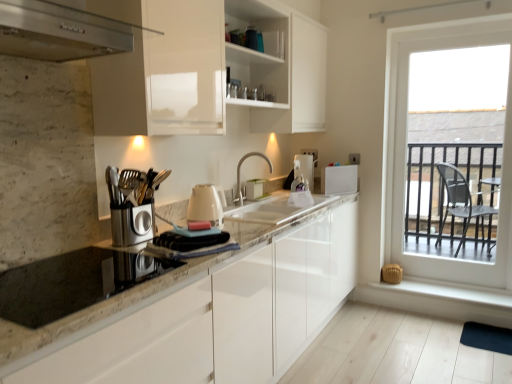
Question: From the image's perspective, is granite countertop at center positioned above or below white plastic toaster at upper right, placed as the 1th appliance when sorted from right to left?

Choices:
 (A) below
 (B) above

Answer: (A)

Question: From a real-world perspective, is granite countertop at center physically located above or below white plastic toaster at upper right, the 3th appliance viewed from the front?

Choices:
 (A) below
 (B) above

Answer: (A)

Question: Which of these objects is positioned farthest from the white glossy kettle at center, arranged as the 2th appliance when viewed from the front?

Choices:
 (A) clear glass window at right
 (B) satin nickel faucet at center
 (C) white marble sink at center
 (D) dark blue rubber mat at lower right
 (E) granite countertop at center

Answer: (D)

Question: Considering the real-world distances, which object is closest to the white marble sink at center?

Choices:
 (A) white smooth window sill at lower right
 (B) dark blue rubber mat at lower right
 (C) white glossy tissue box at center, which is the fourth appliance from front to back
 (D) black glass cooktop at lower left, placed as the 4th appliance when sorted from right to left
 (E) white glossy cabinet at upper center

Answer: (C)